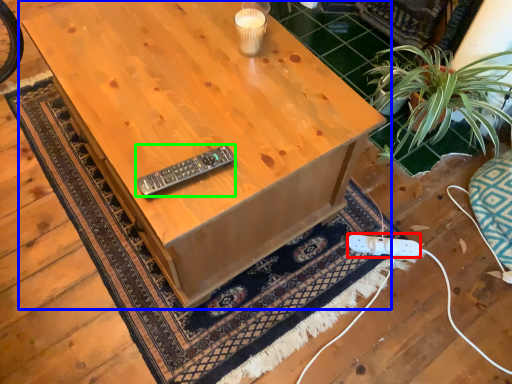
Question: Which is farther away from plug (highlighted by a red box)? table (highlighted by a blue box) or control (highlighted by a green box)?

Choices:
 (A) table
 (B) control

Answer: (B)